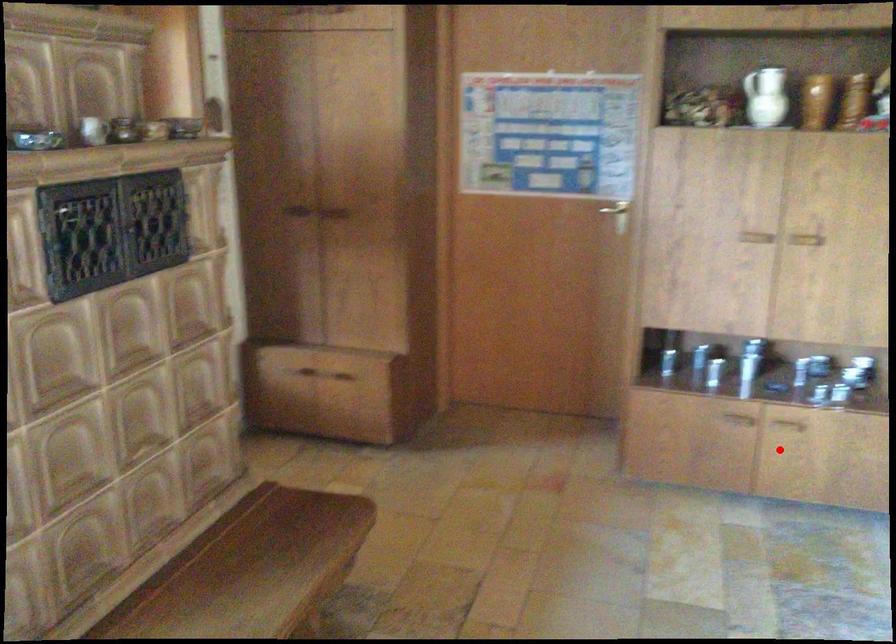
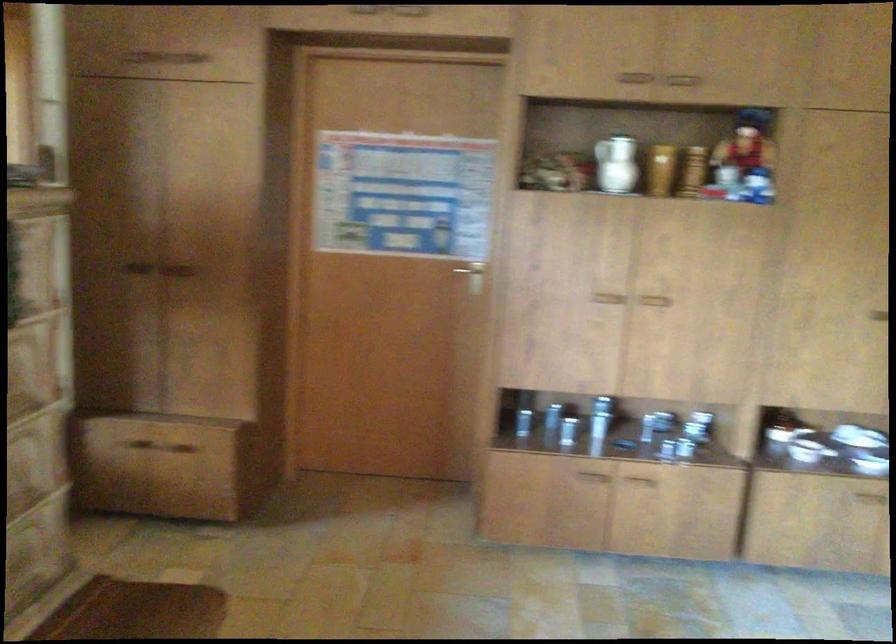
Where in the second image is the point corresponding to the highlighted location from the first image?

(636, 509)